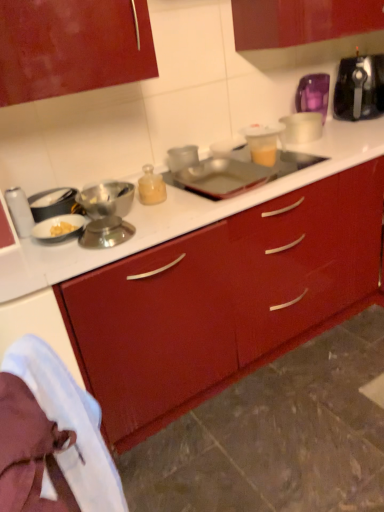
In order to face white fabric at lower left, should I rotate leftwards or rightwards?

A 19.769 degree turn to the left will do.

In order to click on metallic silver tray at center, the second appliance from the left in this screenshot , I will do `click(221, 177)`.

Describe the element at coordinates (262, 142) in the screenshot. I see `translucent plastic cup at upper center, arranged as the second appliance when viewed from the right` at that location.

Describe the element at coordinates (301, 127) in the screenshot. This screenshot has height=512, width=384. I see `translucent plastic cup at upper right, the first appliance in the right-to-left sequence` at that location.

This screenshot has height=512, width=384. Identify the location of white fabric at lower left. [x=69, y=424].

Are translucent plastic cup at upper center, marked as the 3th appliance in a left-to-right arrangement, and metallic canister at left, arranged as the 4th appliance when viewed from the right, making contact?

translucent plastic cup at upper center, marked as the 3th appliance in a left-to-right arrangement, and metallic canister at left, arranged as the 4th appliance when viewed from the right, are not in contact.

From a real-world perspective, which is physically below, translucent plastic cup at upper center, arranged as the second appliance when viewed from the right, or metallic canister at left, which ranks as the first appliance in left-to-right order?

From a 3D spatial view, translucent plastic cup at upper center, arranged as the second appliance when viewed from the right, is below.

From the picture: Is translucent plastic cup at upper center, marked as the 3th appliance in a left-to-right arrangement, to the left or to the right of metallic canister at left, which ranks as the first appliance in left-to-right order, in the image?

translucent plastic cup at upper center, marked as the 3th appliance in a left-to-right arrangement, is to the right of metallic canister at left, which ranks as the first appliance in left-to-right order.

Is point (248, 126) less distant than point (16, 216)?

No, it is not.

From a real-world perspective, is metallic silver tray at center, the second appliance from the left, positioned above or below metallic canister at left, arranged as the 4th appliance when viewed from the right?

Clearly, from a real-world perspective, metallic silver tray at center, the second appliance from the left, is below metallic canister at left, arranged as the 4th appliance when viewed from the right.

Is metallic silver tray at center, which is the 3th appliance from right to left, wider or thinner than metallic canister at left, arranged as the 4th appliance when viewed from the right?

In the image, metallic silver tray at center, which is the 3th appliance from right to left, appears to be wider than metallic canister at left, arranged as the 4th appliance when viewed from the right.

From the image's perspective, is metallic silver tray at center, the second appliance from the left, above metallic canister at left, arranged as the 4th appliance when viewed from the right?

Yes, from the image's perspective, metallic silver tray at center, the second appliance from the left, is on top of metallic canister at left, arranged as the 4th appliance when viewed from the right.

Looking at this image, is metallic silver tray at center, the second appliance from the left, to the left of metallic canister at left, arranged as the 4th appliance when viewed from the right, from the viewer's perspective?

No.

Could you tell me if metallic canister at left, which ranks as the first appliance in left-to-right order, is turned towards metallic silver tray at center, the second appliance from the left?

No, metallic canister at left, which ranks as the first appliance in left-to-right order, is not turned towards metallic silver tray at center, the second appliance from the left.

Identify the location of appliance that is the 3rd object above the metallic silver tray at center, the second appliance from the left (from a real-world perspective). (19, 211).

Visually, is metallic canister at left, arranged as the 4th appliance when viewed from the right, positioned to the left or to the right of metallic silver tray at center, which is the 3th appliance from right to left?

From the image, it's evident that metallic canister at left, arranged as the 4th appliance when viewed from the right, is to the left of metallic silver tray at center, which is the 3th appliance from right to left.

Who is taller, translucent plastic cup at upper center, marked as the 3th appliance in a left-to-right arrangement, or metallic silver tray at center, the second appliance from the left?

translucent plastic cup at upper center, marked as the 3th appliance in a left-to-right arrangement, is taller.

Consider the image. From the image's perspective, is translucent plastic cup at upper center, marked as the 3th appliance in a left-to-right arrangement, above or below metallic silver tray at center, which is the 3th appliance from right to left?

translucent plastic cup at upper center, marked as the 3th appliance in a left-to-right arrangement, is above metallic silver tray at center, which is the 3th appliance from right to left.

Which is more to the left, translucent plastic cup at upper center, marked as the 3th appliance in a left-to-right arrangement, or metallic silver tray at center, the second appliance from the left?

metallic silver tray at center, the second appliance from the left.

Can we say translucent plastic cup at upper center, marked as the 3th appliance in a left-to-right arrangement, lies outside metallic silver tray at center, the second appliance from the left?

That's correct, translucent plastic cup at upper center, marked as the 3th appliance in a left-to-right arrangement, is outside of metallic silver tray at center, the second appliance from the left.

Is metallic silver tray at center, which is the 3th appliance from right to left, in front of or behind translucent plastic cup at upper center, marked as the 3th appliance in a left-to-right arrangement, in the image?

In the image, metallic silver tray at center, which is the 3th appliance from right to left, appears in front of translucent plastic cup at upper center, marked as the 3th appliance in a left-to-right arrangement.

The height and width of the screenshot is (512, 384). What are the coordinates of `appliance that is the 1st object to the left of the translucent plastic cup at upper center, marked as the 3th appliance in a left-to-right arrangement, starting at the anchor` in the screenshot? It's located at (221, 177).

Measure the distance between metallic silver tray at center, the second appliance from the left, and translucent plastic cup at upper center, marked as the 3th appliance in a left-to-right arrangement.

They are 6.50 inches apart.

Which object is positioned more to the right, metallic silver tray at center, which is the 3th appliance from right to left, or translucent plastic cup at upper center, marked as the 3th appliance in a left-to-right arrangement?

From the viewer's perspective, translucent plastic cup at upper center, marked as the 3th appliance in a left-to-right arrangement, appears more on the right side.

Is white fabric at lower left not close to metallic silver tray at center, which is the 3th appliance from right to left?

That's right, there is a large distance between white fabric at lower left and metallic silver tray at center, which is the 3th appliance from right to left.

From the picture: Which of these two, white fabric at lower left or metallic silver tray at center, which is the 3th appliance from right to left, stands taller?

white fabric at lower left.

How different are the orientations of white fabric at lower left and metallic silver tray at center, which is the 3th appliance from right to left, in degrees?

The angular difference between white fabric at lower left and metallic silver tray at center, which is the 3th appliance from right to left, is 102 degrees.

In the scene shown: Does white fabric at lower left appear on the left side of metallic silver tray at center, the second appliance from the left?

Yes, white fabric at lower left is to the left of metallic silver tray at center, the second appliance from the left.

Is translucent plastic cup at upper right, which is counted as the fourth appliance, starting from the left, wider or thinner than white fabric at lower left?

In the image, translucent plastic cup at upper right, which is counted as the fourth appliance, starting from the left, appears to be wider than white fabric at lower left.

Is translucent plastic cup at upper right, which is counted as the fourth appliance, starting from the left, to the left of white fabric at lower left from the viewer's perspective?

In fact, translucent plastic cup at upper right, which is counted as the fourth appliance, starting from the left, is to the right of white fabric at lower left.

Is translucent plastic cup at upper right, which is counted as the fourth appliance, starting from the left, not within white fabric at lower left?

Yes, translucent plastic cup at upper right, which is counted as the fourth appliance, starting from the left, is located beyond the bounds of white fabric at lower left.

From the metallic canister at left, arranged as the 4th appliance when viewed from the right, count 2nd appliance to the right and point to it. Please provide its 2D coordinates.

[(262, 142)]

The width and height of the screenshot is (384, 512). Identify the location of appliance lying in front of the metallic silver tray at center, the second appliance from the left. (19, 211).

When comparing their distances from white fabric at lower left, does translucent plastic cup at upper center, marked as the 3th appliance in a left-to-right arrangement, or translucent plastic cup at upper right, which is counted as the fourth appliance, starting from the left, seem further?

The object further to white fabric at lower left is translucent plastic cup at upper right, which is counted as the fourth appliance, starting from the left.

Looking at the image, which one is located further to metallic silver tray at center, which is the 3th appliance from right to left, white fabric at lower left or translucent plastic cup at upper center, marked as the 3th appliance in a left-to-right arrangement?

white fabric at lower left is positioned further to the anchor metallic silver tray at center, which is the 3th appliance from right to left.

Which object lies further to the anchor point metallic canister at left, arranged as the 4th appliance when viewed from the right, translucent plastic cup at upper center, marked as the 3th appliance in a left-to-right arrangement, or white fabric at lower left?

translucent plastic cup at upper center, marked as the 3th appliance in a left-to-right arrangement, is positioned further to the anchor metallic canister at left, arranged as the 4th appliance when viewed from the right.

Considering their positions, is black plastic toaster at upper right positioned closer to metallic canister at left, arranged as the 4th appliance when viewed from the right, than white fabric at lower left?

The object closer to metallic canister at left, arranged as the 4th appliance when viewed from the right, is white fabric at lower left.

Which object lies nearer to the anchor point translucent plastic cup at upper center, marked as the 3th appliance in a left-to-right arrangement, translucent plastic cup at upper right, which is counted as the fourth appliance, starting from the left, or white fabric at lower left?

translucent plastic cup at upper right, which is counted as the fourth appliance, starting from the left, is positioned closer to the anchor translucent plastic cup at upper center, marked as the 3th appliance in a left-to-right arrangement.

Considering their positions, is metallic silver tray at center, the second appliance from the left, positioned closer to metallic canister at left, which ranks as the first appliance in left-to-right order, than black plastic toaster at upper right?

metallic silver tray at center, the second appliance from the left, is closer to metallic canister at left, which ranks as the first appliance in left-to-right order.

Considering their positions, is translucent plastic cup at upper center, marked as the 3th appliance in a left-to-right arrangement, positioned further to black plastic toaster at upper right than metallic silver tray at center, the second appliance from the left?

Based on the image, metallic silver tray at center, the second appliance from the left, appears to be further to black plastic toaster at upper right.

Looking at the image, which one is located further to black plastic toaster at upper right, metallic canister at left, arranged as the 4th appliance when viewed from the right, or metallic silver tray at center, which is the 3th appliance from right to left?

Among the two, metallic canister at left, arranged as the 4th appliance when viewed from the right, is located further to black plastic toaster at upper right.

Locate an element on the screen. The height and width of the screenshot is (512, 384). appliance between white fabric at lower left and metallic silver tray at center, which is the 3th appliance from right to left, from front to back is located at coordinates (19, 211).

Image resolution: width=384 pixels, height=512 pixels. I want to click on appliance between translucent plastic cup at upper center, marked as the 3th appliance in a left-to-right arrangement, and black plastic toaster at upper right, so click(301, 127).

At what (x,y) coordinates should I click in order to perform the action: click on appliance situated between metallic canister at left, which ranks as the first appliance in left-to-right order, and translucent plastic cup at upper center, arranged as the second appliance when viewed from the right, from left to right. Please return your answer as a coordinate pair (x, y). The width and height of the screenshot is (384, 512). Looking at the image, I should click on (221, 177).

Identify the location of appliance between metallic silver tray at center, the second appliance from the left, and translucent plastic cup at upper right, which is counted as the fourth appliance, starting from the left, along the z-axis. The width and height of the screenshot is (384, 512). (262, 142).